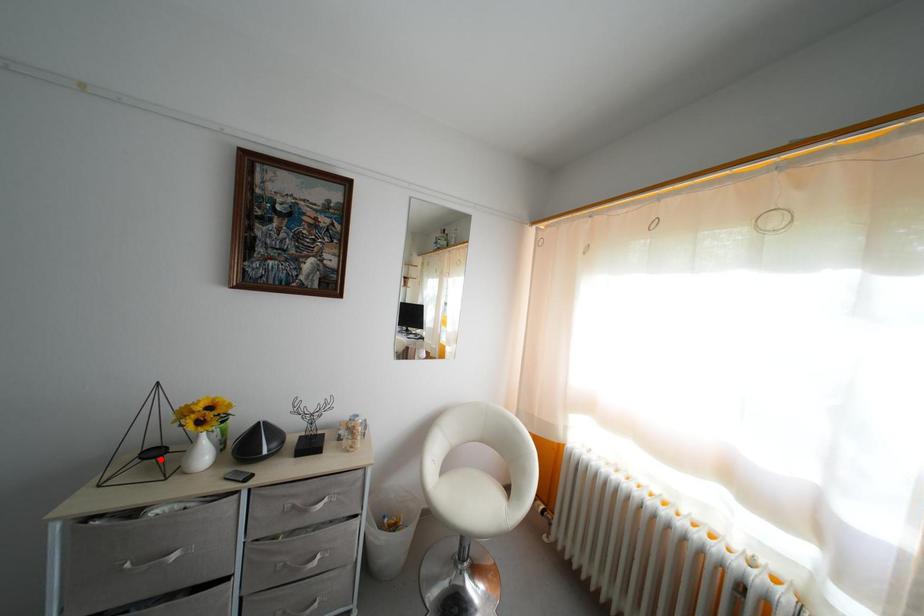
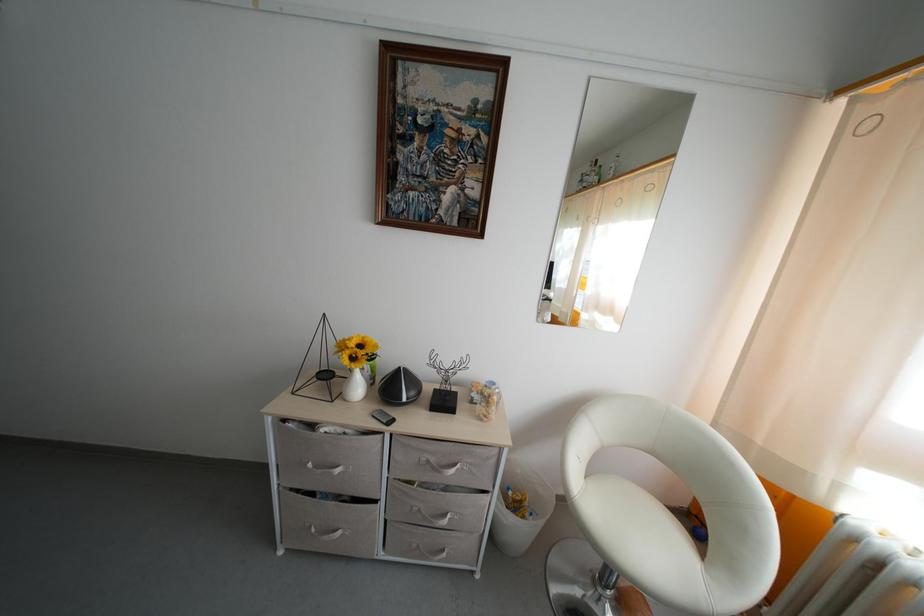
Where in the second image is the point corresponding to the highlighted location from the first image?

(332, 382)